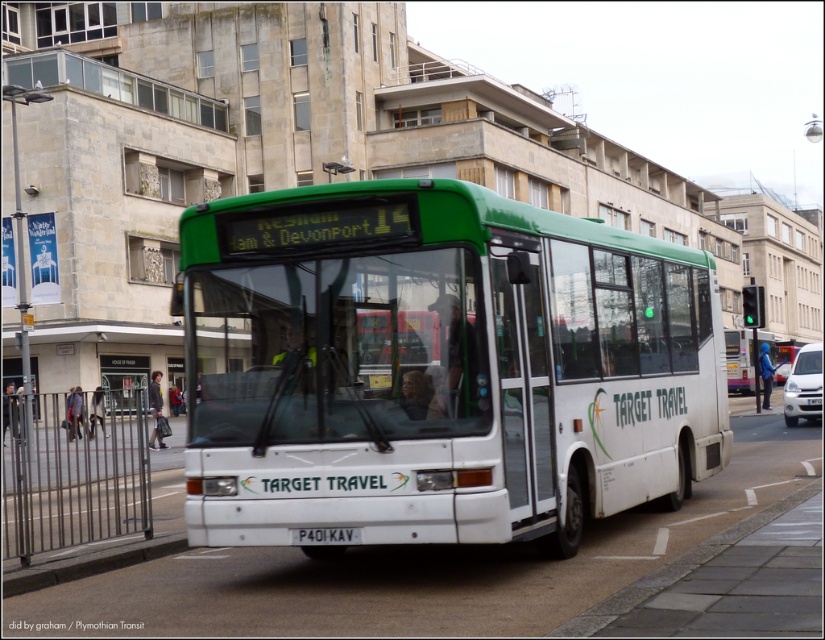
Looking at this image, you are a pedestrian standing on the sidewalk next to the white matte bus at center and the black plastic license plate at center. Which object is higher from the ground?

The white matte bus at center is located above the black plastic license plate at center, so the white matte bus at center is higher from the ground.

You are standing on the sidewalk next to the white matte bus at center. If you want to walk to the fence that is behind the bus, which direction should you go relative to the bus?

The white matte bus at center is located at point (437, 365). Since the fence is behind the bus, you should walk behind the white matte bus at center to reach it.

You are standing in front of the Target Travel bus and want to take a photo. You notice two points marked on the bus. Which point, point (390, 493) or point (314, 536), is closer to you?

Point (390, 493) is closer to you than point (314, 536).